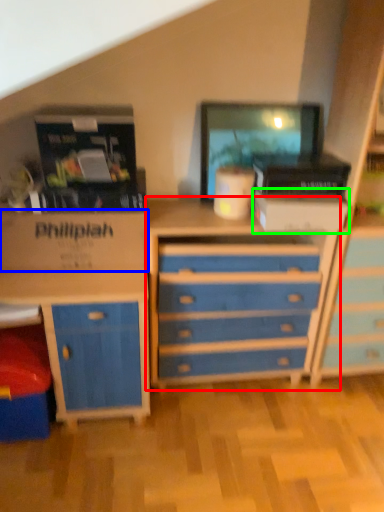
Question: Based on their relative distances, which object is farther from chest of drawers (highlighted by a red box)? Choose from cardboard box (highlighted by a blue box) and storage box (highlighted by a green box).

Choices:
 (A) cardboard box
 (B) storage box

Answer: (A)